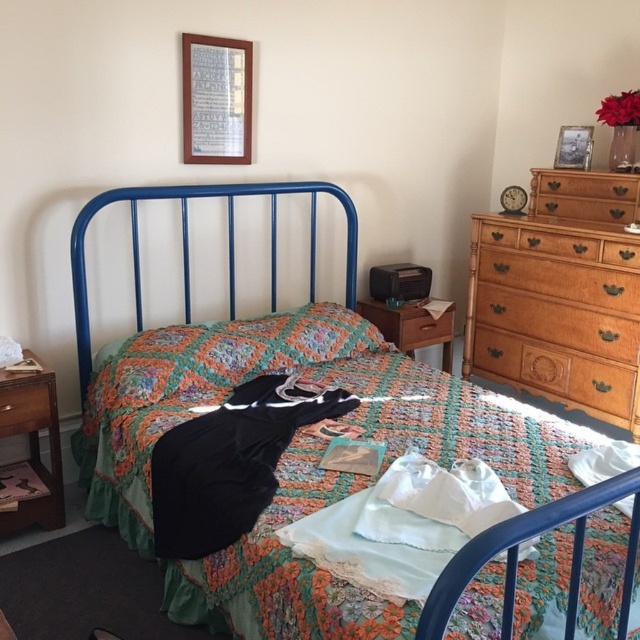
Question: Estimate the real-world distances between objects in this image. Which object is farther from the light brown wooden dresser at right?

Choices:
 (A) brown wood drawer at center
 (B) wooden drawer at left

Answer: (B)

Question: Which point appears closest to the camera in this image?

Choices:
 (A) (42, 394)
 (B) (618, 486)
 (C) (305, 323)

Answer: (B)

Question: Is light brown wooden dresser at right wider than floral crocheted pillow at center?

Choices:
 (A) no
 (B) yes

Answer: (A)

Question: Which point is farther to the camera?

Choices:
 (A) (419, 314)
 (B) (449, 342)
 (C) (321, 358)
 (D) (493, 252)

Answer: (B)

Question: Does light brown wooden dresser at right have a smaller size compared to metallic blue bed at center?

Choices:
 (A) yes
 (B) no

Answer: (A)

Question: Is the position of metallic blue bed at center more distant than that of wooden drawer at left?

Choices:
 (A) yes
 (B) no

Answer: (A)